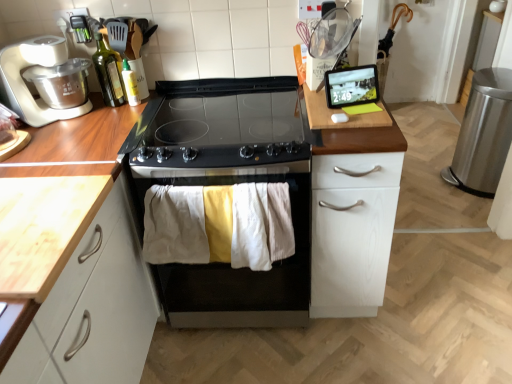
Question: From a real-world perspective, relative to light wood countertop at left, is white matte food processor at left vertically above or below?

Choices:
 (A) above
 (B) below

Answer: (A)

Question: In the image, is white matte food processor at left on the left side or the right side of light wood countertop at left?

Choices:
 (A) left
 (B) right

Answer: (A)

Question: Which object is positioned closest to the white matte food processor at left?

Choices:
 (A) light wood countertop at left
 (B) black stainless steel oven at center
 (C) matte black tablet at upper right
 (D) white matte cabinet at right
 (E) translucent plastic bottle at upper left, marked as the 2th bottle in a left-to-right arrangement

Answer: (E)

Question: Which is nearer to the black stainless steel oven at center?

Choices:
 (A) matte black tablet at upper right
 (B) white matte food processor at left
 (C) green glass bottle at upper left, the 2th bottle positioned from the right
 (D) light wood countertop at left
 (E) black glass cooktop at center

Answer: (E)